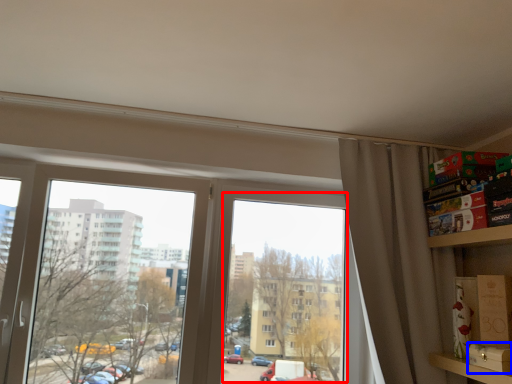
Question: Which object appears closest to the camera in this image, window screen (highlighted by a red box) or cardboard box (highlighted by a blue box)?

Choices:
 (A) window screen
 (B) cardboard box

Answer: (B)